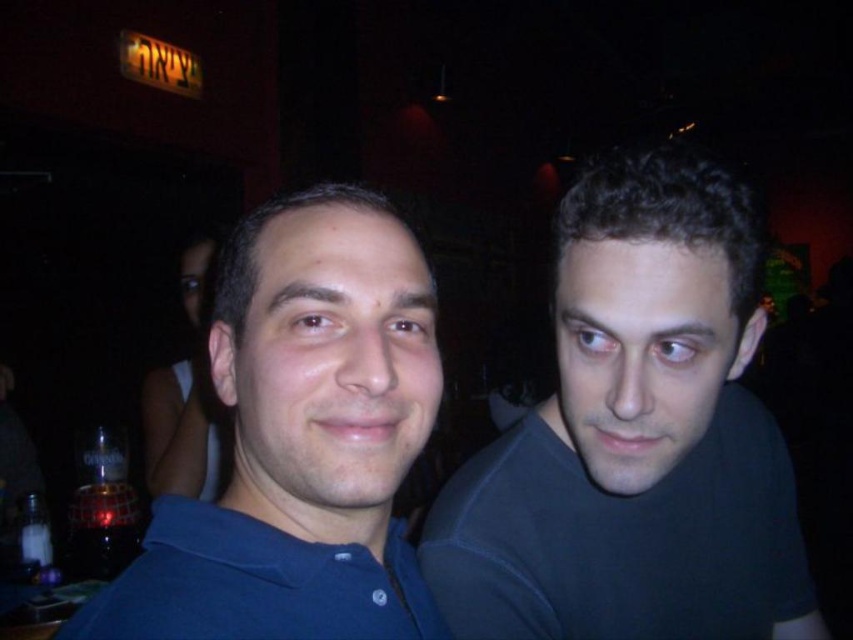
Question: Which of the following is the farthest from the observer?

Choices:
 (A) blue matte shirt at center
 (B) dark blue shirt at right

Answer: (B)

Question: Which point is closer to the camera?

Choices:
 (A) (576, 477)
 (B) (397, 426)

Answer: (B)

Question: Is dark blue shirt at right below blue matte shirt at center?

Choices:
 (A) no
 (B) yes

Answer: (B)

Question: Where is dark blue shirt at right located in relation to blue matte shirt at center in the image?

Choices:
 (A) below
 (B) above

Answer: (A)

Question: Can you confirm if dark blue shirt at right is positioned to the right of blue matte shirt at center?

Choices:
 (A) no
 (B) yes

Answer: (B)